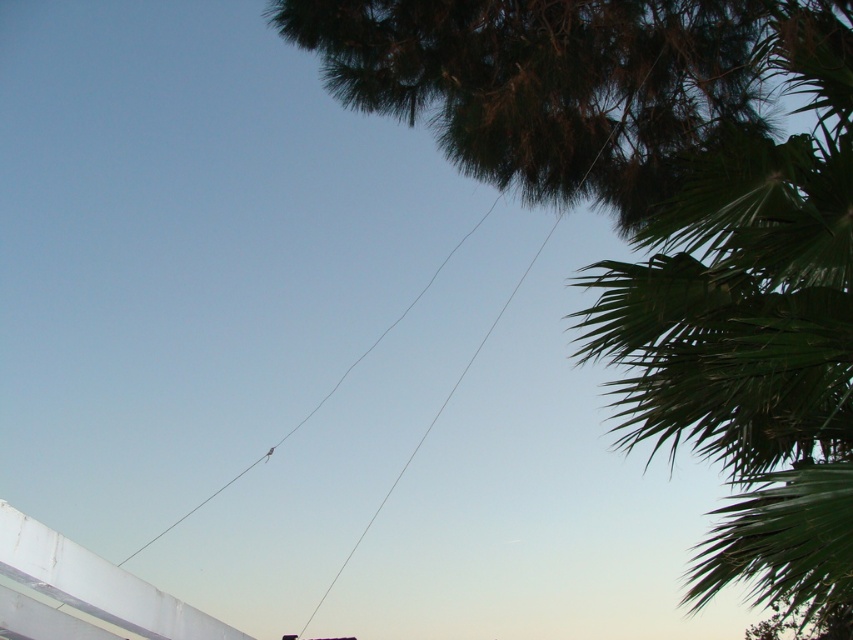
Question: Which point is closer to the camera?

Choices:
 (A) (726, 540)
 (B) (556, 72)

Answer: (A)

Question: Which of the following is the farthest from the observer?

Choices:
 (A) (810, 285)
 (B) (461, 243)
 (C) (772, 150)

Answer: (B)

Question: Is green leafy tree at upper right to the left of green leafy palm tree at upper right from the viewer's perspective?

Choices:
 (A) no
 (B) yes

Answer: (B)

Question: Is green leafy palm tree at upper right thinner than clear wire at center?

Choices:
 (A) no
 (B) yes

Answer: (A)

Question: Is green leafy tree at upper right above clear wire at center?

Choices:
 (A) no
 (B) yes

Answer: (B)

Question: Among these points, which one is farthest from the camera?

Choices:
 (A) (129, 554)
 (B) (724, 529)
 (C) (729, 176)

Answer: (A)